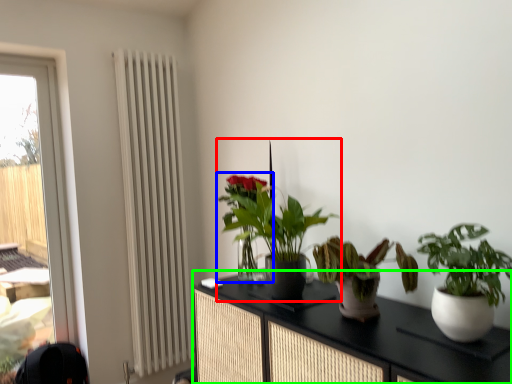
Question: Considering the real-world distances, which object is farthest from houseplant (highlighted by a red box)? houseplant (highlighted by a blue box) or cabinetry (highlighted by a green box)?

Choices:
 (A) houseplant
 (B) cabinetry

Answer: (B)